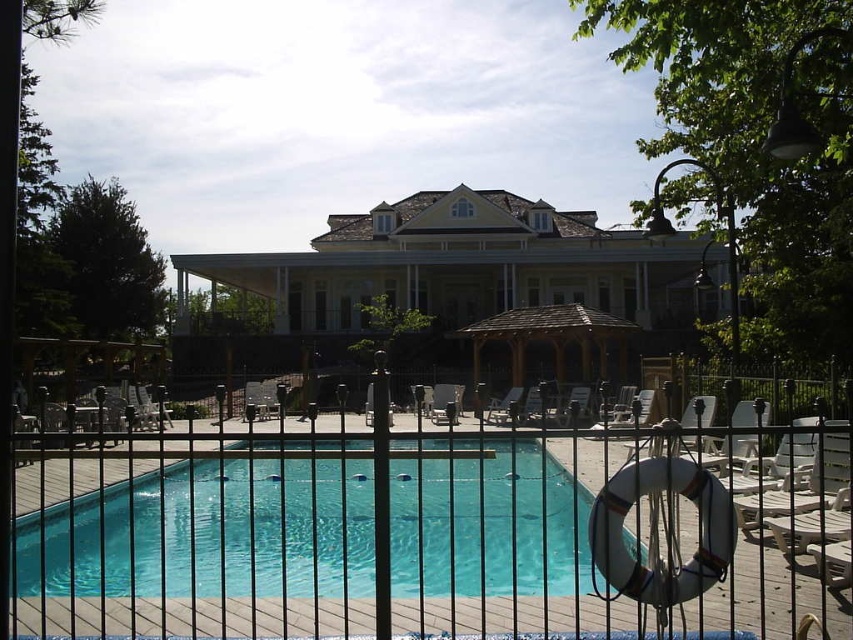
You are planning to host a small gathering in the pool area and need to place a large table. Given the presence of the brown wooden gazebo at center and the wooden lounge chair at center, which object should you avoid placing the table near to ensure there is enough space?

You should avoid placing the table near the brown wooden gazebo at center because it has a larger size compared to the wooden lounge chair at center, which would leave less space for the table.

You are standing at point (x=451, y=385) and want to walk to the building in the background. Is the point (x=614, y=528) between you and the building?

Point (x=614, y=528) is in front of point (x=451, y=385), so yes, it is between you and the building.